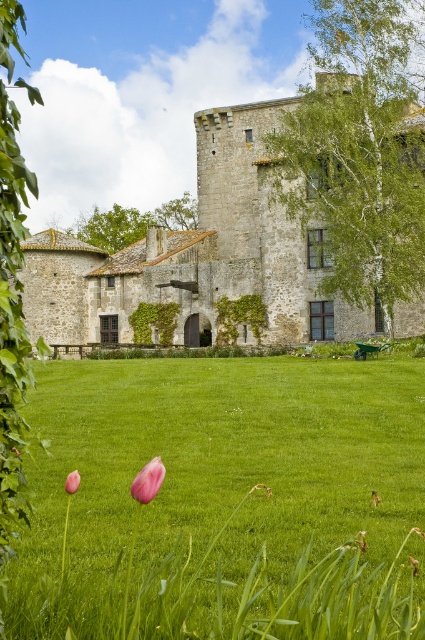
Between green grass at lower center and pink matte tulip at lower center, which one has less height?

With less height is pink matte tulip at lower center.

Does point (235, 410) lie in front of point (138, 483)?

No, it is not.

Find the location of a particular element. The width and height of the screenshot is (425, 640). green grass at lower center is located at coordinates (224, 500).

Who is positioned more to the left, green grass at lower center or stone castle at center?

From the viewer's perspective, stone castle at center appears more on the left side.

This screenshot has height=640, width=425. In order to click on green grass at lower center in this screenshot , I will do `click(224, 500)`.

Where is `green grass at lower center`? green grass at lower center is located at coordinates (224, 500).

Can you confirm if pink matte tulip at lower center is positioned below pink matte tulip at lower left?

Actually, pink matte tulip at lower center is above pink matte tulip at lower left.

Can you confirm if pink matte tulip at lower center is bigger than pink matte tulip at lower left?

Correct, pink matte tulip at lower center is larger in size than pink matte tulip at lower left.

The height and width of the screenshot is (640, 425). What do you see at coordinates (147, 481) in the screenshot?
I see `pink matte tulip at lower center` at bounding box center [147, 481].

This screenshot has height=640, width=425. I want to click on pink matte tulip at lower center, so click(147, 481).